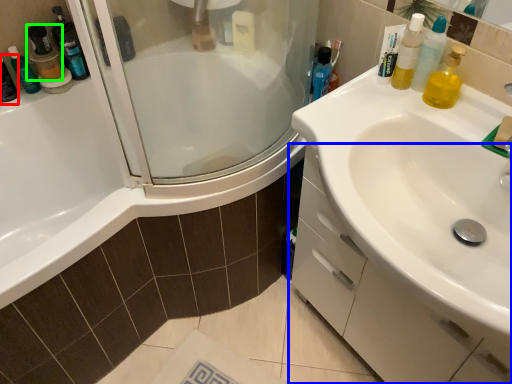
Question: Which object is the farthest from mouthwash (highlighted by a red box)? Choose among these: bathroom cabinet (highlighted by a blue box) or mouthwash (highlighted by a green box).

Choices:
 (A) bathroom cabinet
 (B) mouthwash

Answer: (A)